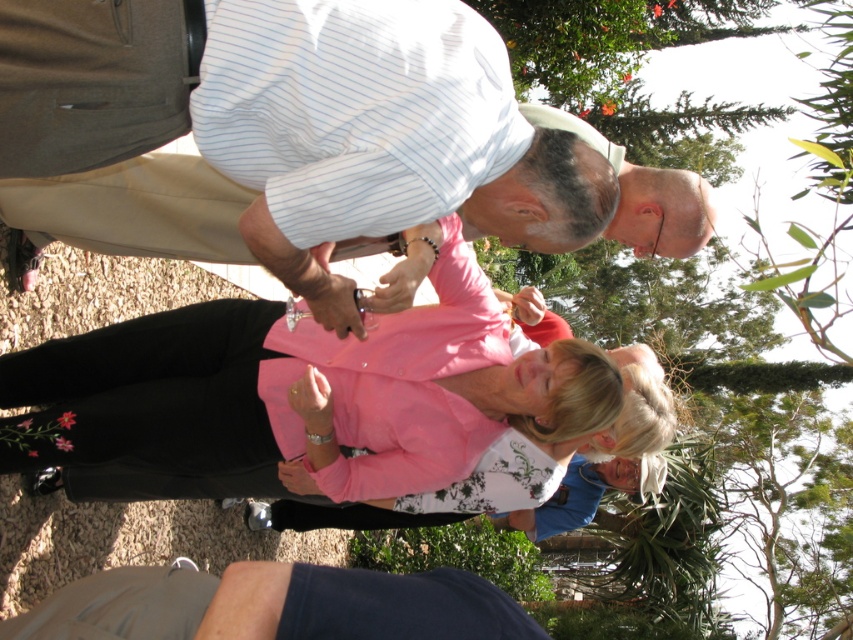
Looking at this image, is white striped shirt at upper center bigger than dark blue fabric at lower center?

Yes.

Can you confirm if white striped shirt at upper center is thinner than dark blue fabric at lower center?

No, white striped shirt at upper center is not thinner than dark blue fabric at lower center.

This screenshot has width=853, height=640. What are the coordinates of `white striped shirt at upper center` in the screenshot? It's located at (334, 128).

Can you confirm if pink fabric blouse at center is positioned to the left of dark blue fabric at lower center?

In fact, pink fabric blouse at center is to the right of dark blue fabric at lower center.

Measure the distance from pink fabric blouse at center to dark blue fabric at lower center.

pink fabric blouse at center is 36.59 inches from dark blue fabric at lower center.

Is point (418, 468) in front of point (51, 621)?

That is False.

At what (x,y) coordinates should I click in order to perform the action: click on pink fabric blouse at center. Please return your answer as a coordinate pair (x, y). This screenshot has height=640, width=853. Looking at the image, I should click on (260, 394).

Which is more to the right, white striped shirt at upper center or pink fabric blouse at center?

white striped shirt at upper center is more to the right.

Is white striped shirt at upper center behind pink fabric blouse at center?

That is False.

Between point (297, 4) and point (370, 406), which one is positioned in front?

Point (297, 4) is in front.

Where is `white striped shirt at upper center`? This screenshot has width=853, height=640. white striped shirt at upper center is located at coordinates (334, 128).